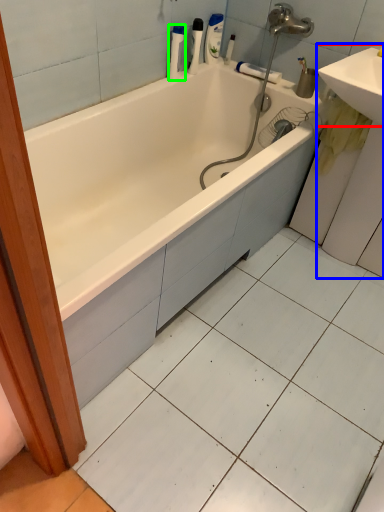
Question: Considering the real-world distances, which object is farthest from sink (highlighted by a red box)? sink (highlighted by a blue box) or cleaning product (highlighted by a green box)?

Choices:
 (A) sink
 (B) cleaning product

Answer: (B)